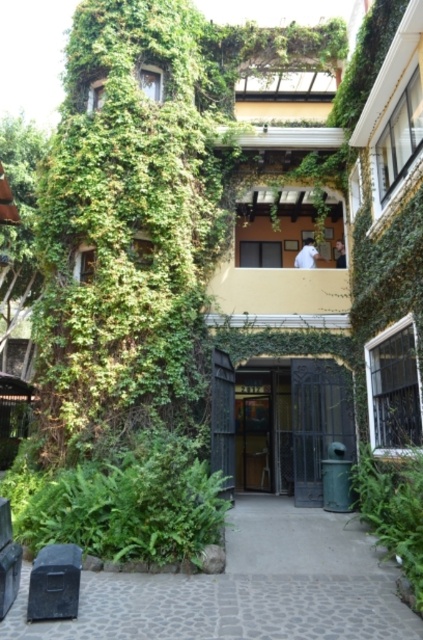
You are a delivery person arriving at the building and need to access the entrance. You see the metallic gate at center and the green leafy plant at lower right. Which object is bigger in size?

The metallic gate at center is larger in size than the green leafy plant at lower right.

You are a gardener standing at the entrance of the building and need to water the green leafy bush at lower left. The watering can you have can spray water up to 6 meters. Do you think you can water it without moving closer?

The distance between you and the green leafy bush at lower left is 5.94 meters, so yes, the watering can can spray far enough to reach it without moving closer.